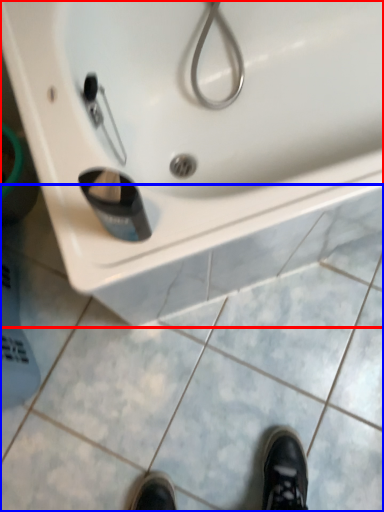
Question: Which of the following is the farthest to the observer, sink (highlighted by a red box) or tile (highlighted by a blue box)?

Choices:
 (A) sink
 (B) tile

Answer: (B)